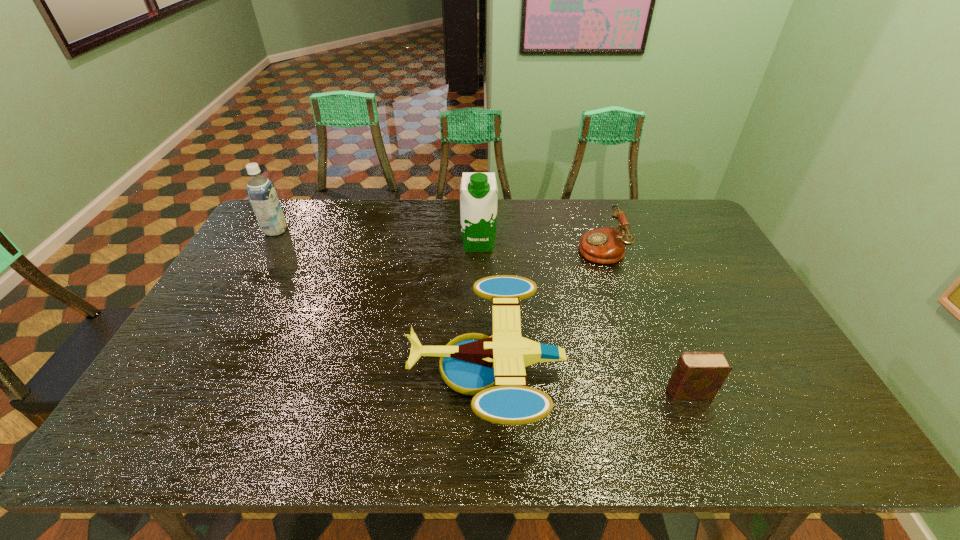
This screenshot has width=960, height=540. In order to click on the right soya milk in this screenshot , I will do `click(478, 199)`.

In order to click on the leftmost object in this screenshot , I will do `click(261, 192)`.

This screenshot has height=540, width=960. What are the coordinates of `telephone` in the screenshot? It's located at (607, 245).

Locate an element on the screen. The image size is (960, 540). diary is located at coordinates (698, 375).

At what (x,y) coordinates should I click in order to perform the action: click on drone. Please return your answer as a coordinate pair (x, y). This screenshot has height=540, width=960. Looking at the image, I should click on (492, 368).

Where is `vacant space situated 0.350m on the front-facing side of the right soya milk`? The height and width of the screenshot is (540, 960). vacant space situated 0.350m on the front-facing side of the right soya milk is located at coordinates (479, 336).

The width and height of the screenshot is (960, 540). In order to click on vacant area situated on the label of the leftmost object in this screenshot , I will do `click(324, 231)`.

Where is `blank space located on the dial of the telephone`? blank space located on the dial of the telephone is located at coordinates (465, 247).

Find the location of a particular element. vacant space positioned 0.360m on the dial of the telephone is located at coordinates pos(470,247).

Image resolution: width=960 pixels, height=540 pixels. In order to click on vacant space located on the dial of the telephone in this screenshot , I will do `click(551, 247)`.